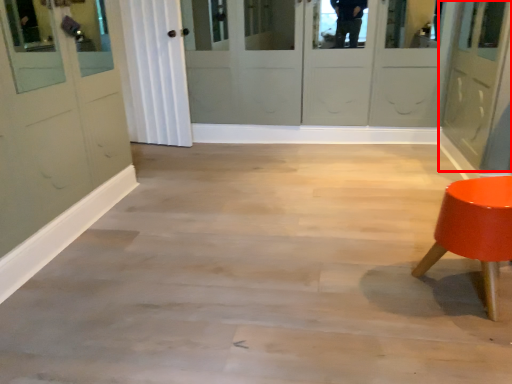
Question: From the image's perspective, where is door (annotated by the red box) located relative to furniture?

Choices:
 (A) above
 (B) below

Answer: (A)